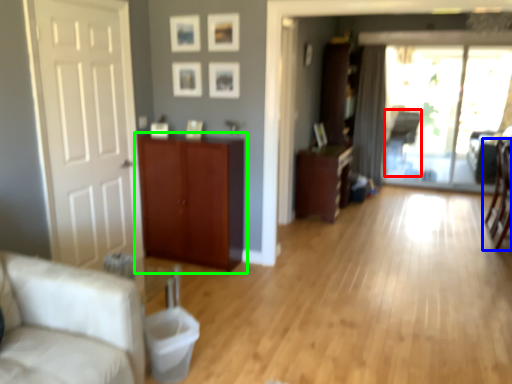
Question: Which object is the closest to the armchair (highlighted by a red box)? Choose among these: chair (highlighted by a blue box) or cabinetry (highlighted by a green box).

Choices:
 (A) chair
 (B) cabinetry

Answer: (A)